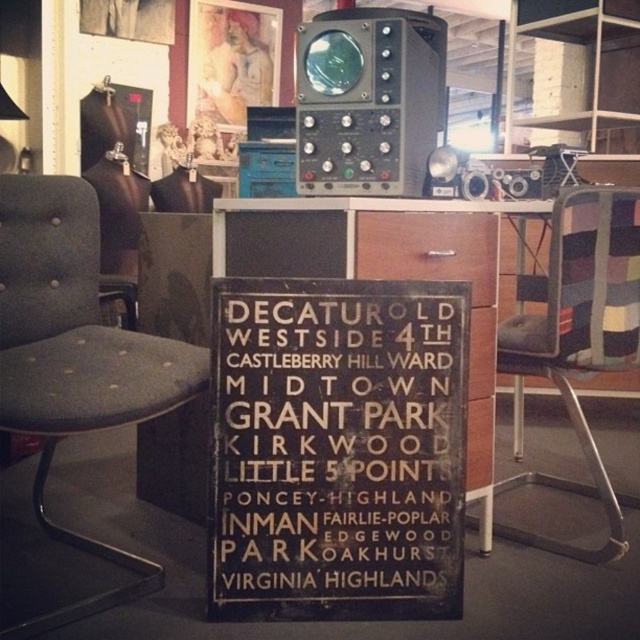
You are holding a camera and want to take a photo of the brown wood sign at center. If you are standing 1.43 meters away from the sign, is this distance sufficient to capture the entire sign in the frame?

The distance between you and the brown wood sign at center is 1.43 meters. Whether this is sufficient depends on your camera lens. A standard lens might require closer or farther distance, but since the sign is at center and you are exactly at 1.43 meters, it might be possible if the lens allows capturing the entire sign at that distance.

You are sitting in the striped fabric swivel chair at right and want to read the brown wood sign at center. Is the sign within your line of sight without needing to move your head?

The brown wood sign at center is closer to the viewer than the striped fabric swivel chair at right, so yes, the sign is within your line of sight without needing to move your head.

You are sitting in the dark gray fabric swivel chair at left and want to read the brown wood sign at center. Is the sign positioned in a way that you can easily see it from your current position?

The brown wood sign at center is located below the dark gray fabric swivel chair at left, so you can easily see it from your current position as it is positioned directly beneath you.